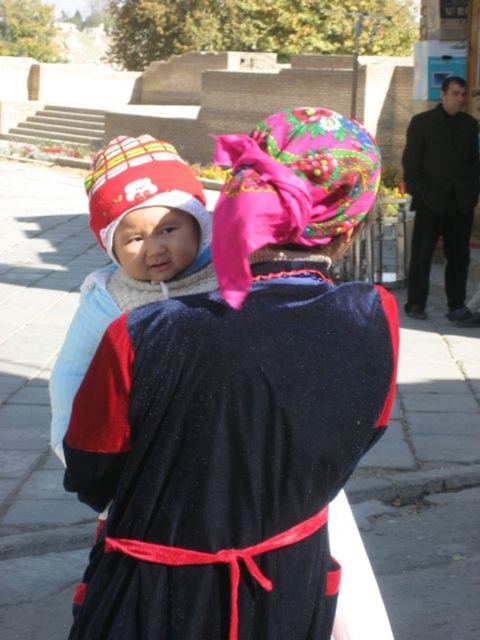
What do you see at coordinates (228, 456) in the screenshot? I see `velvet dark blue dress at center` at bounding box center [228, 456].

Can you confirm if velvet dark blue dress at center is bigger than black matte robe at right?

Actually, velvet dark blue dress at center might be smaller than black matte robe at right.

What do you see at coordinates (228, 456) in the screenshot? This screenshot has width=480, height=640. I see `velvet dark blue dress at center` at bounding box center [228, 456].

Where is `velvet dark blue dress at center`? The image size is (480, 640). velvet dark blue dress at center is located at coordinates (228, 456).

Is velvet dark blue dress at center further to camera compared to matte red knit hat at left?

No, velvet dark blue dress at center is closer to the viewer.

Is velvet dark blue dress at center smaller than matte red knit hat at left?

Answer: No, velvet dark blue dress at center is not smaller than matte red knit hat at left.

This screenshot has width=480, height=640. What do you see at coordinates (228, 456) in the screenshot? I see `velvet dark blue dress at center` at bounding box center [228, 456].

Where is `velvet dark blue dress at center`? Image resolution: width=480 pixels, height=640 pixels. velvet dark blue dress at center is located at coordinates (228, 456).

Is matte red knit hat at left thinner than black matte robe at right?

Indeed, matte red knit hat at left has a lesser width compared to black matte robe at right.

Can you confirm if matte red knit hat at left is bigger than black matte robe at right?

Incorrect, matte red knit hat at left is not larger than black matte robe at right.

Is point (59, 404) positioned after point (441, 154)?

No.

Identify the location of matte red knit hat at left. This screenshot has height=640, width=480. (132, 252).